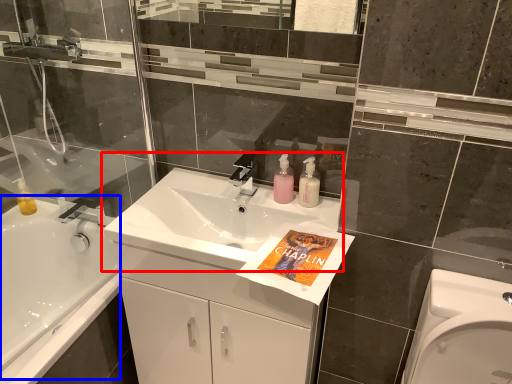
Question: Among these objects, which one is nearest to the camera, sink (highlighted by a red box) or bath (highlighted by a blue box)?

Choices:
 (A) sink
 (B) bath

Answer: (A)